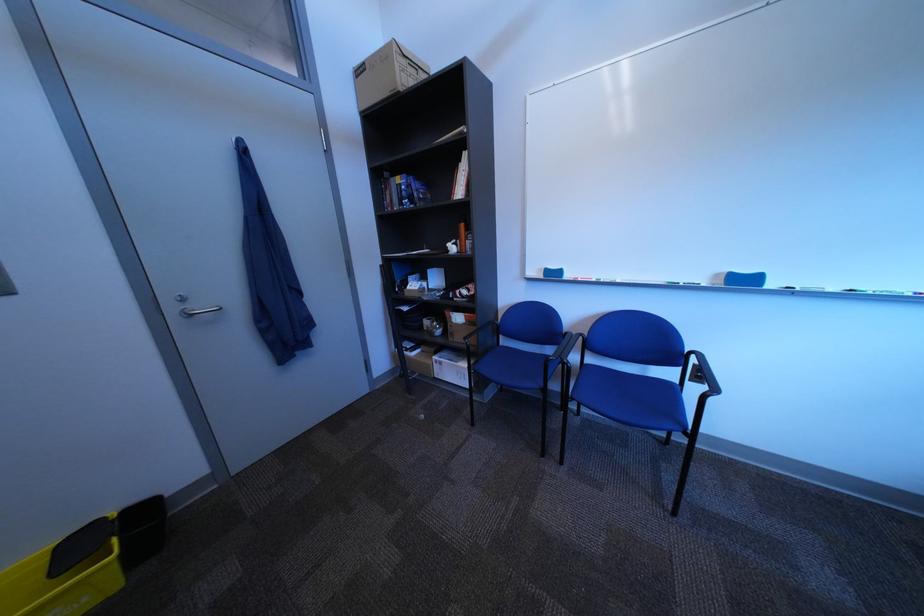
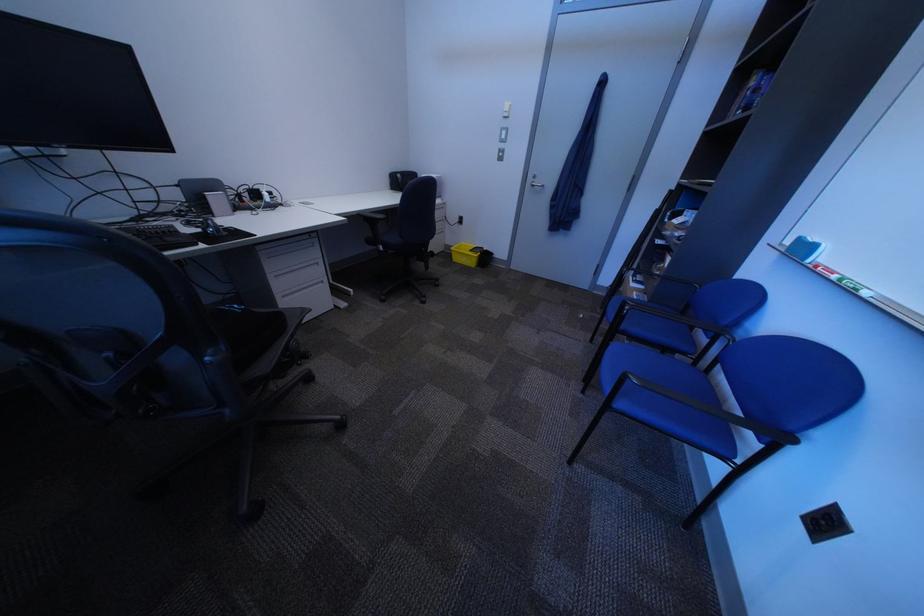
Find the pixel in the second image that matches [610,282] in the first image.

(849, 278)